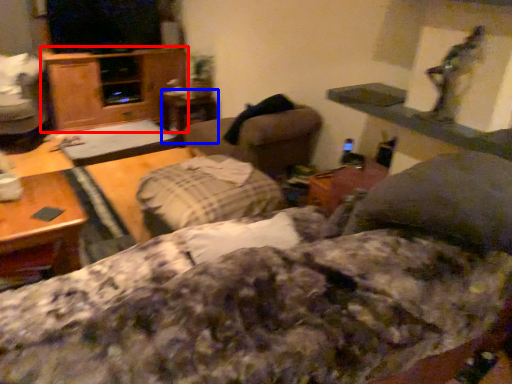
Question: Which object appears farthest to the camera in this image, dresser (highlighted by a red box) or table (highlighted by a blue box)?

Choices:
 (A) dresser
 (B) table

Answer: (B)